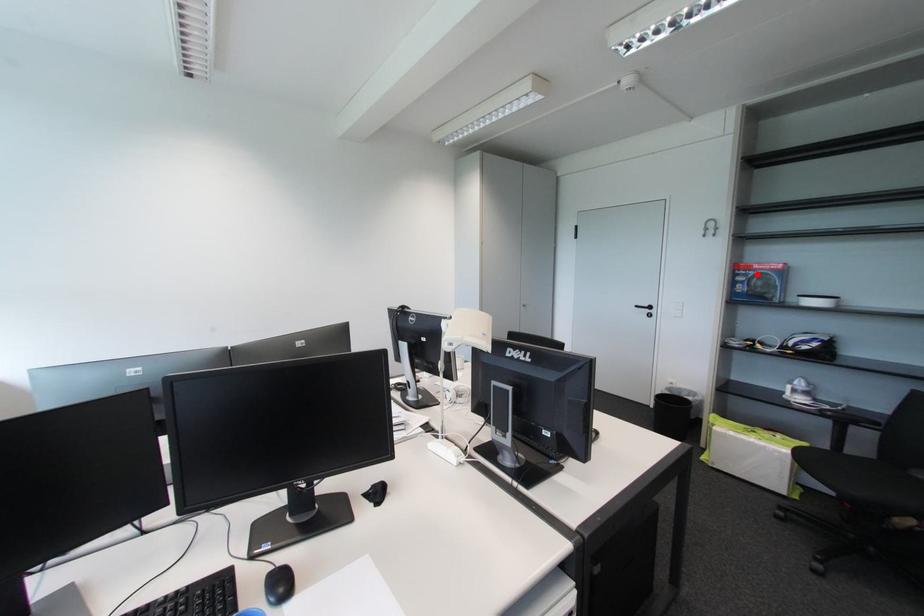
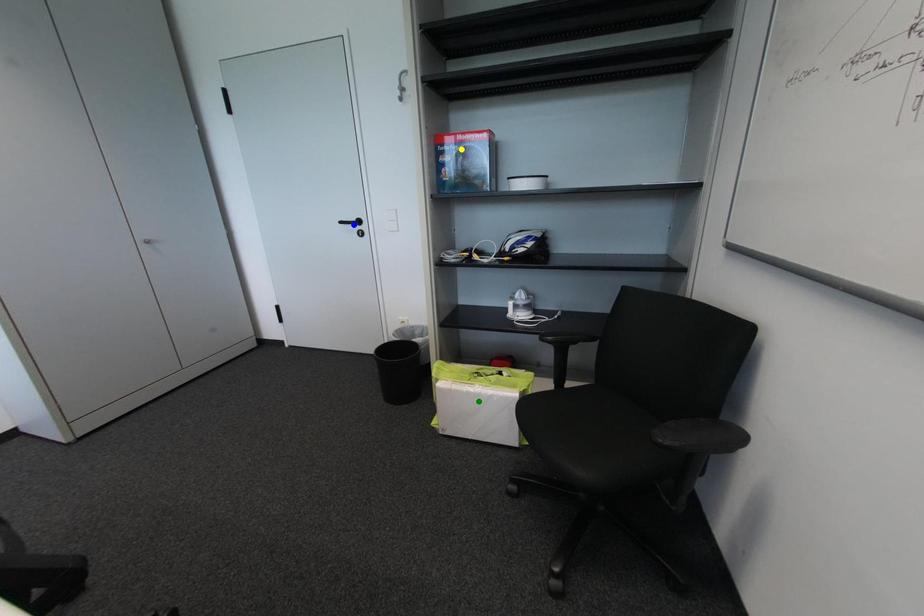
Question: I am providing you with two images of the same scene from different viewpoints. A red point is marked on the first image. You are given multiple points on the second image. Which mark in image 2 goes with the point in image 1?

Choices:
 (A) green point
 (B) blue point
 (C) yellow point

Answer: (C)